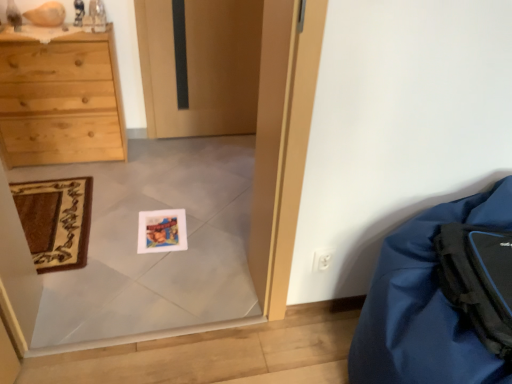
You are a GUI agent. You are given a task and a screenshot of the screen. Output one action in this format:
    pyautogui.click(x=<x>, y=<y>)
    Task: Click on the black matte backpack at lower right
    
    Given the screenshot: What is the action you would take?
    pyautogui.click(x=478, y=280)

The image size is (512, 384). I want to click on blue fabric bean bag at lower right, so click(425, 305).

At what (x,y) coordinates should I click in order to perform the action: click on carpeted mat at lower left. Please return your answer as a coordinate pair (x, y). This screenshot has height=384, width=512. Looking at the image, I should click on (56, 221).

You are a GUI agent. You are given a task and a screenshot of the screen. Output one action in this format:
    pyautogui.click(x=<x>, y=<y>)
    Task: Click on the black matte backpack at lower right
    The width and height of the screenshot is (512, 384).
    Given the screenshot: What is the action you would take?
    pyautogui.click(x=478, y=280)

Does carpeted mat at lower left have a smaller size compared to blue fabric bean bag at lower right?

Yes, carpeted mat at lower left is smaller than blue fabric bean bag at lower right.

Is carpeted mat at lower left not close to blue fabric bean bag at lower right?

carpeted mat at lower left is positioned a significant distance from blue fabric bean bag at lower right.

From a real-world perspective, does carpeted mat at lower left sit lower than blue fabric bean bag at lower right?

Yes, from a real-world perspective, carpeted mat at lower left is under blue fabric bean bag at lower right.

Considering the sizes of carpeted mat at lower left and blue fabric bean bag at lower right in the image, is carpeted mat at lower left taller or shorter than blue fabric bean bag at lower right?

Clearly, carpeted mat at lower left is shorter compared to blue fabric bean bag at lower right.

Which of these two, blue fabric bean bag at lower right or black matte backpack at lower right, is thinner?

black matte backpack at lower right.

Is blue fabric bean bag at lower right next to black matte backpack at lower right?

No, blue fabric bean bag at lower right is not next to black matte backpack at lower right.

Is blue fabric bean bag at lower right at the left side of black matte backpack at lower right?

In fact, blue fabric bean bag at lower right is to the right of black matte backpack at lower right.

Visually, is black matte backpack at lower right positioned to the left or to the right of blue fabric bean bag at lower right?

From the image, it's evident that black matte backpack at lower right is to the left of blue fabric bean bag at lower right.

In the image, is black matte backpack at lower right positioned in front of or behind blue fabric bean bag at lower right?

black matte backpack at lower right is positioned farther from the viewer than blue fabric bean bag at lower right.

Does black matte backpack at lower right touch blue fabric bean bag at lower right?

No, black matte backpack at lower right is not making contact with blue fabric bean bag at lower right.

From the image's perspective, which object appears higher, black matte backpack at lower right or carpeted mat at lower left?

carpeted mat at lower left.

Is black matte backpack at lower right to the left or to the right of carpeted mat at lower left in the image?

From the image, it's evident that black matte backpack at lower right is to the right of carpeted mat at lower left.

Considering the sizes of objects black matte backpack at lower right and carpeted mat at lower left in the image provided, who is bigger, black matte backpack at lower right or carpeted mat at lower left?

black matte backpack at lower right is bigger.

At what (x,y) coordinates should I click in order to perform the action: click on mat located above the black matte backpack at lower right (from the image's perspective). Please return your answer as a coordinate pair (x, y). Looking at the image, I should click on (56, 221).

Can you tell me how much blue fabric bean bag at lower right and carpeted mat at lower left differ in facing direction?

The angle between the facing direction of blue fabric bean bag at lower right and the facing direction of carpeted mat at lower left is 179 degrees.

Does blue fabric bean bag at lower right have a lesser width compared to carpeted mat at lower left?

No.

Considering the positions of point (387, 314) and point (61, 211), is point (387, 314) closer or farther from the camera than point (61, 211)?

Point (387, 314) is positioned closer to the camera compared to point (61, 211).

Would you consider blue fabric bean bag at lower right to be distant from carpeted mat at lower left?

Yes, blue fabric bean bag at lower right and carpeted mat at lower left are quite far apart.

What's the angular difference between carpeted mat at lower left and black matte backpack at lower right's facing directions?

They differ by 172 degrees in their facing directions.

Could you tell me if carpeted mat at lower left is facing black matte backpack at lower right?

No, carpeted mat at lower left is not facing towards black matte backpack at lower right.

Does carpeted mat at lower left appear on the left side of black matte backpack at lower right?

Yes, carpeted mat at lower left is to the left of black matte backpack at lower right.

Where is `furniture above the carpeted mat at lower left (from a real-world perspective)`? furniture above the carpeted mat at lower left (from a real-world perspective) is located at coordinates (425, 305).

I want to click on backpack located above the blue fabric bean bag at lower right (from the image's perspective), so click(x=478, y=280).

Based on their spatial positions, is blue fabric bean bag at lower right or black matte backpack at lower right further from carpeted mat at lower left?

The object further to carpeted mat at lower left is black matte backpack at lower right.

From the image, which object appears to be farther from black matte backpack at lower right, blue fabric bean bag at lower right or carpeted mat at lower left?

The object further to black matte backpack at lower right is carpeted mat at lower left.

Estimate the real-world distances between objects in this image. Which object is further from blue fabric bean bag at lower right, black matte backpack at lower right or carpeted mat at lower left?

carpeted mat at lower left.

Looking at the image, which one is located further to black matte backpack at lower right, carpeted mat at lower left or blue fabric bean bag at lower right?

The object further to black matte backpack at lower right is carpeted mat at lower left.

Which object lies nearer to the anchor point carpeted mat at lower left, black matte backpack at lower right or blue fabric bean bag at lower right?

blue fabric bean bag at lower right lies closer to carpeted mat at lower left than the other object.

When comparing their distances from blue fabric bean bag at lower right, does carpeted mat at lower left or black matte backpack at lower right seem closer?

black matte backpack at lower right.

Locate an element on the screen. backpack between carpeted mat at lower left and blue fabric bean bag at lower right is located at coordinates (478, 280).